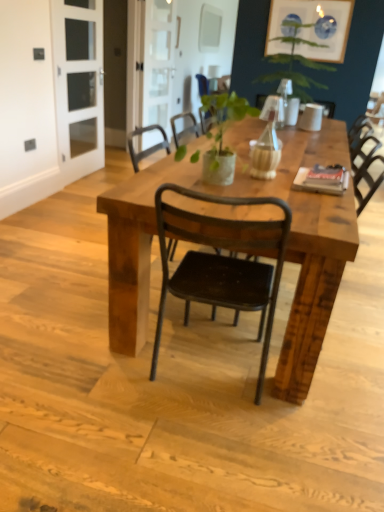
Question: From their relative heights in the image, would you say black metal chair at center, the 2th chair positioned from the top, is taller or shorter than black metal chair at center, which is counted as the 2th chair, starting from the front?

Choices:
 (A) tall
 (B) short

Answer: (A)

Question: Is point tap(173, 197) closer or farther from the camera than point tap(213, 93)?

Choices:
 (A) farther
 (B) closer

Answer: (B)

Question: Which of these objects is positioned farthest from the black metal chair at center, arranged as the first chair when viewed from the front?

Choices:
 (A) rustic wood table at center
 (B) green leafy plant at upper center
 (C) clear glass door at upper left, placed as the first screen door when sorted from front to back
 (D) green matte plant at center
 (E) black metal chair at center, the 2th chair positioned from the bottom

Answer: (C)

Question: Which object is positioned closest to the green leafy plant at upper center?

Choices:
 (A) black metal chair at center, the 2th chair positioned from the bottom
 (B) black metal chair at center, the 2th chair positioned from the top
 (C) rustic wood table at center
 (D) green matte plant at center
 (E) clear glass door at upper left, placed as the first screen door when sorted from front to back

Answer: (A)